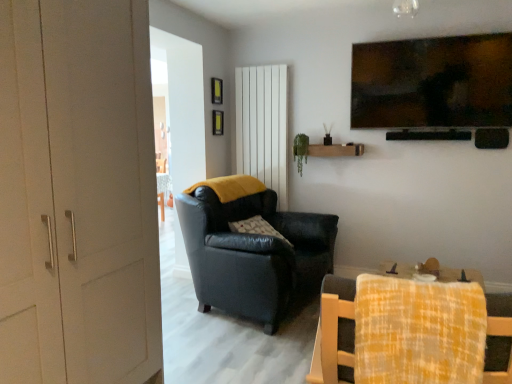
Question: Is leather armchair at center, which ranks as the second chair in front-to-back order, smaller than white matte door at left?

Choices:
 (A) no
 (B) yes

Answer: (B)

Question: Is the surface of leather armchair at center, which ranks as the 1th chair in back-to-front order, in direct contact with white matte door at left?

Choices:
 (A) no
 (B) yes

Answer: (A)

Question: Does leather armchair at center, which ranks as the second chair in front-to-back order, lie behind white matte door at left?

Choices:
 (A) no
 (B) yes

Answer: (B)

Question: Can you confirm if leather armchair at center, which ranks as the 1th chair in back-to-front order, is taller than white matte door at left?

Choices:
 (A) yes
 (B) no

Answer: (B)

Question: Is leather armchair at center, which ranks as the 1th chair in back-to-front order, shorter than white matte door at left?

Choices:
 (A) no
 (B) yes

Answer: (B)

Question: Is leather armchair at center, which ranks as the second chair in front-to-back order, facing towards white matte door at left?

Choices:
 (A) yes
 (B) no

Answer: (B)

Question: Is white matte door at left at the left side of white vertical panel at center?

Choices:
 (A) yes
 (B) no

Answer: (A)

Question: Is white matte door at left positioned before white vertical panel at center?

Choices:
 (A) no
 (B) yes

Answer: (B)

Question: Does white matte door at left have a larger size compared to white vertical panel at center?

Choices:
 (A) no
 (B) yes

Answer: (B)

Question: Is white matte door at left wider than white vertical panel at center?

Choices:
 (A) no
 (B) yes

Answer: (B)

Question: Considering the relative positions of white matte door at left and white vertical panel at center in the image provided, is white matte door at left behind white vertical panel at center?

Choices:
 (A) no
 (B) yes

Answer: (A)

Question: Is white vertical panel at center surrounded by white matte door at left?

Choices:
 (A) yes
 (B) no

Answer: (B)

Question: From a real-world perspective, is white matte door at left under yellow plaid fabric at lower right, which is the first chair in front-to-back order?

Choices:
 (A) no
 (B) yes

Answer: (A)